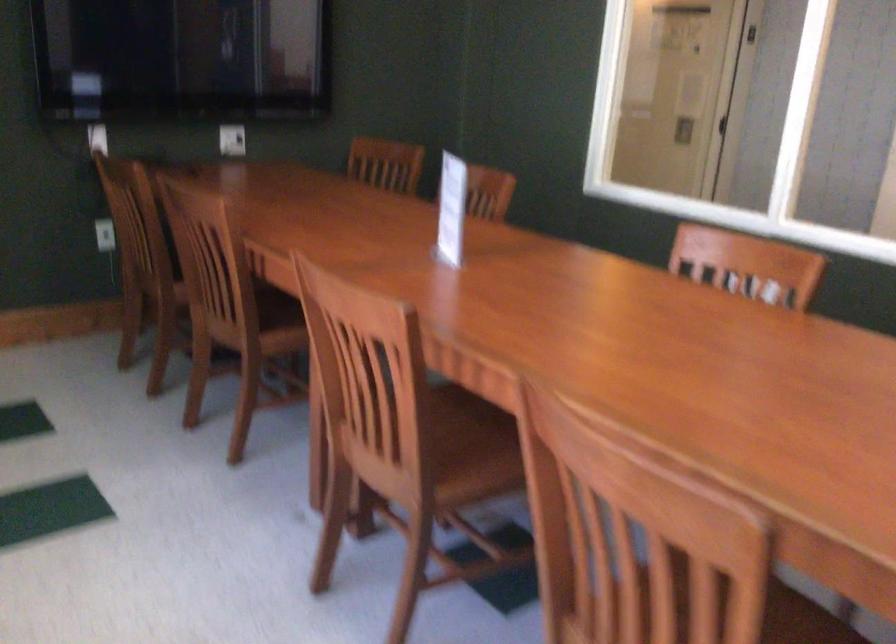
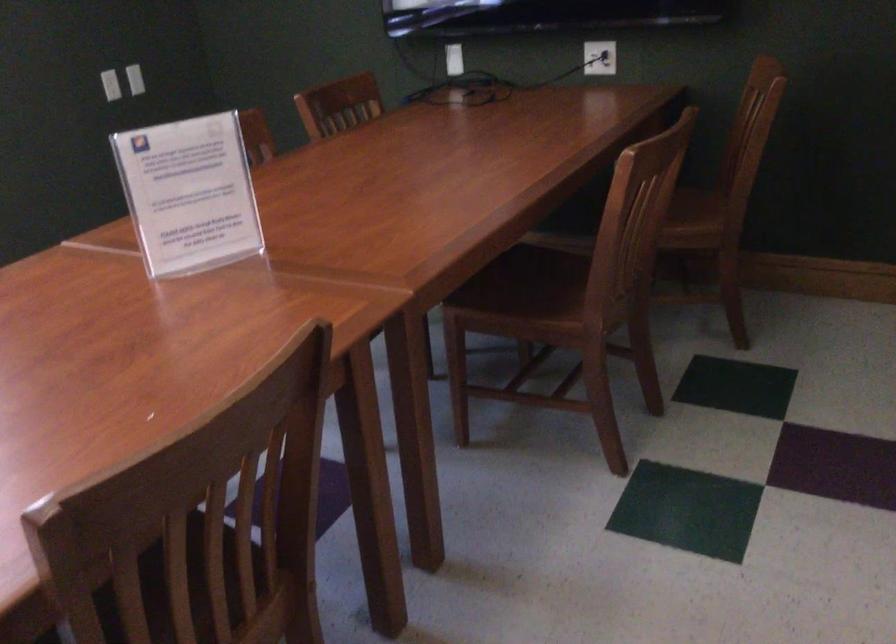
Question: I am providing you with two images of the same scene from different viewpoints. After the viewpoint changes to image2, which objects are now occluded?

Choices:
 (A) wooden chair sitting surface
 (B) brown chair sitting surface
 (C) small sauce bottle
 (D) white electrical outlet

Answer: (A)